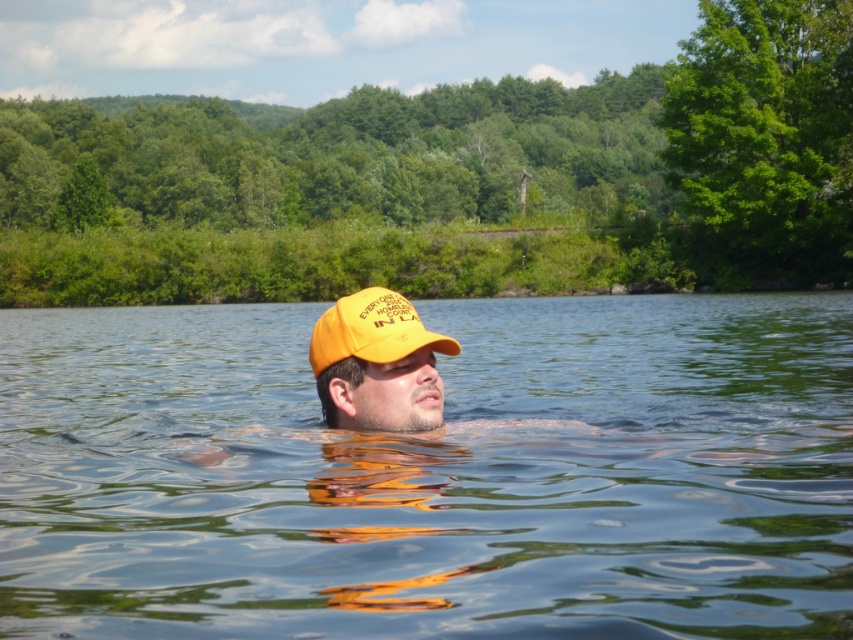
Question: Among these points, which one is farthest from the camera?

Choices:
 (A) (624, 524)
 (B) (361, 294)

Answer: (A)

Question: Among these objects, which one is farthest from the camera?

Choices:
 (A) transparent water at center
 (B) yellow matte baseball cap at center

Answer: (B)

Question: Which point appears farthest from the camera in this image?

Choices:
 (A) (509, 627)
 (B) (407, 332)

Answer: (B)

Question: From the image, what is the correct spatial relationship of transparent water at center in relation to yellow matte baseball cap at center?

Choices:
 (A) above
 (B) below

Answer: (A)

Question: Is transparent water at center smaller than yellow matte baseball cap at center?

Choices:
 (A) no
 (B) yes

Answer: (A)

Question: Is transparent water at center further to the viewer compared to yellow matte baseball cap at center?

Choices:
 (A) yes
 (B) no

Answer: (B)